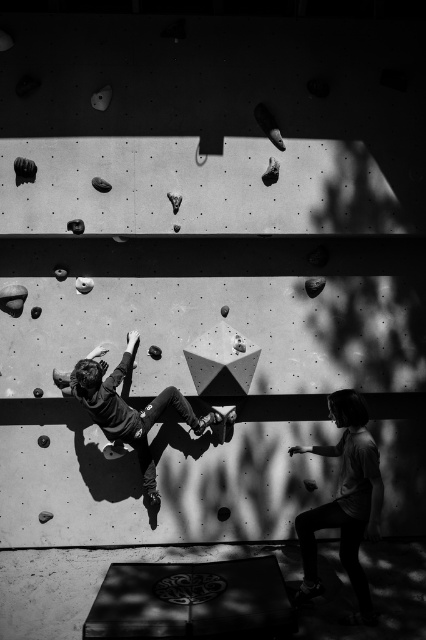
You are a beginner climber looking at the climbing wall. You see the light gray cotton shirt at lower right and the smooth gray climbing hold at center. Which object takes up more area in the photo?

The smooth gray climbing hold at center takes up more area in the photo than the light gray cotton shirt at lower right because the light gray cotton shirt at lower right occupies less space than smooth gray climbing hold at center.

You are a beginner climber looking at the climbing wall. You notice the light gray cotton shirt at lower right and the smooth gray climbing hold at center. Which object is closer to you?

The light gray cotton shirt at lower right is closer to you since it is in front of the smooth gray climbing hold at center.

You are a beginner climber looking at the climbing wall. You see the light gray cotton shirt at lower right and the smooth gray climbing hold at center. Which object is positioned more to the right side of the image?

The light gray cotton shirt at lower right is positioned more to the right side of the image than the smooth gray climbing hold at center.